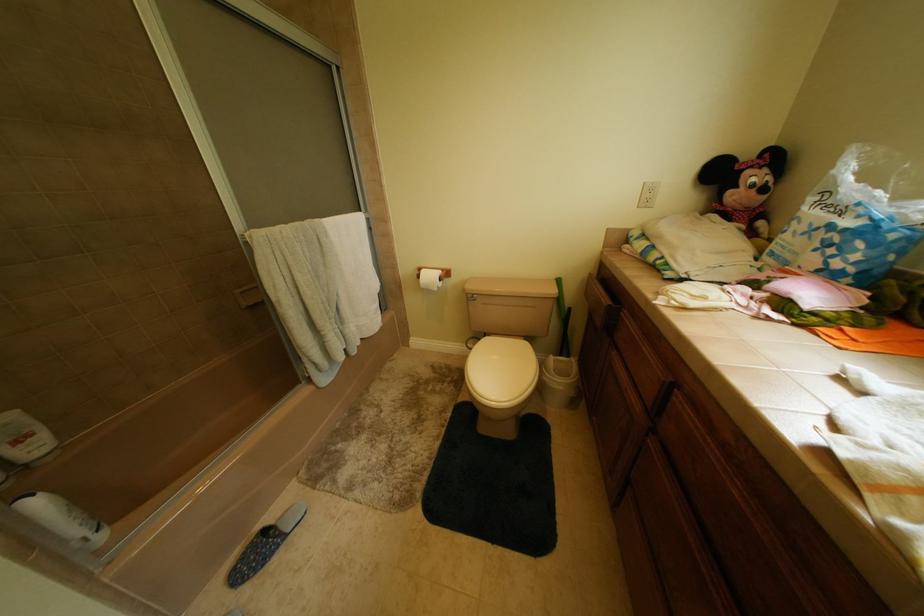
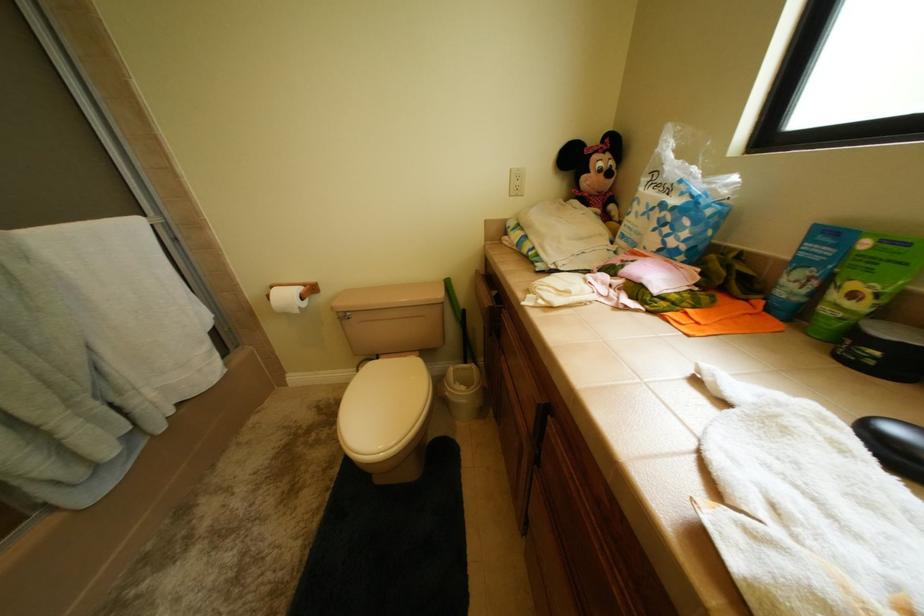
Question: Based on the continuous images, in which direction is the camera rotating? Reply with the corresponding letter.

Choices:
 (A) Left
 (B) Right
 (C) Up
 (D) Down

Answer: (B)